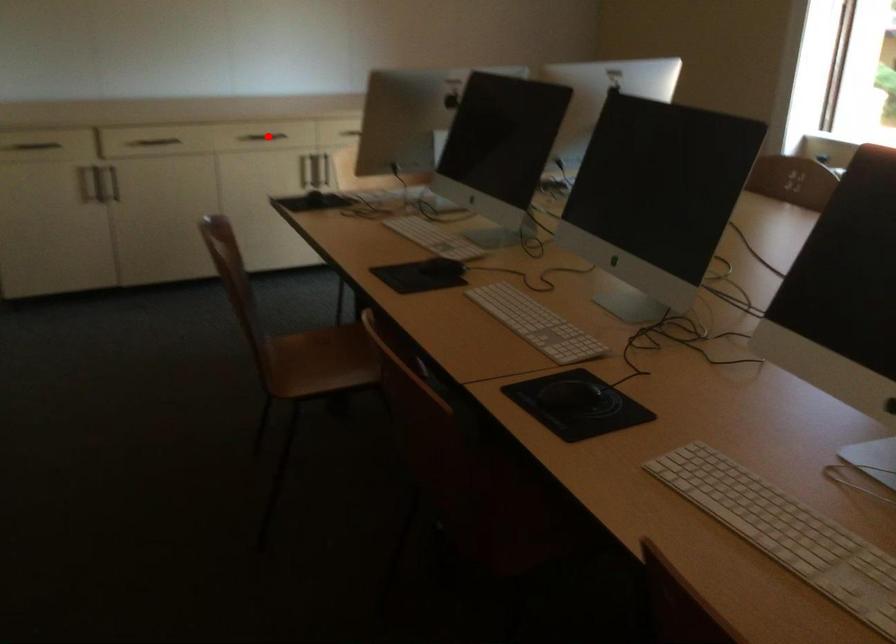
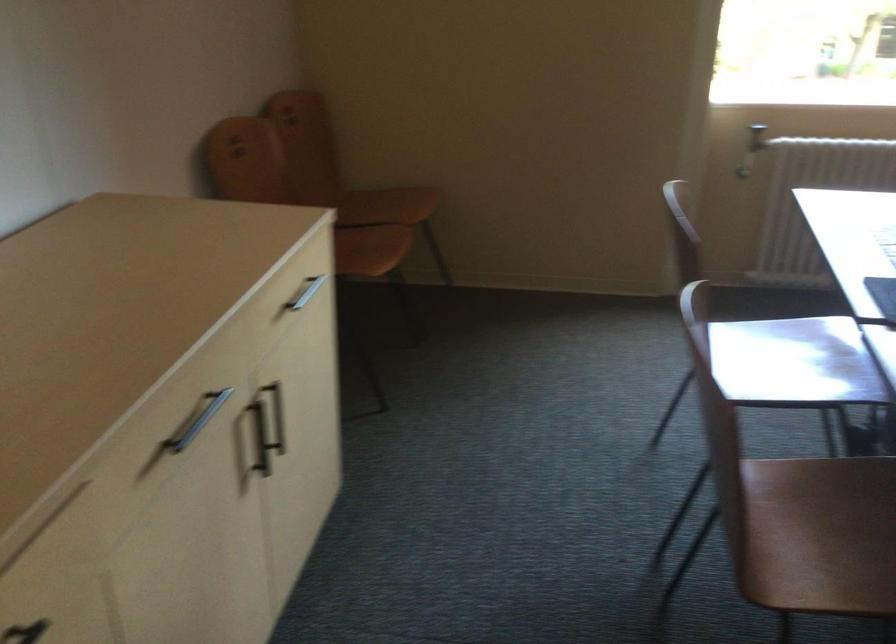
Question: I am providing you with two images of the same scene from different viewpoints. In image1, a red point is highlighted. Considering the same 3D point in image2, which of the following is correct?

Choices:
 (A) It is closer
 (B) It is farther

Answer: (A)